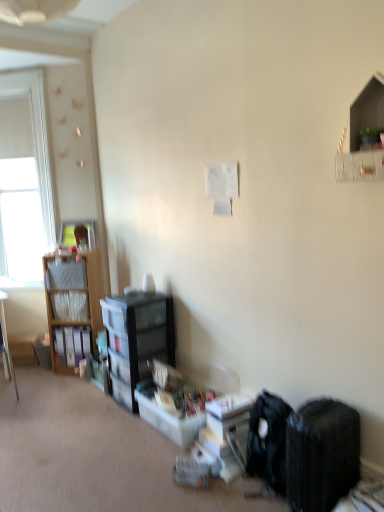
Question: Does black plastic bookcase at center-left have a larger size compared to white glossy shelf at upper right, placed as the first shelf when sorted from top to bottom?

Choices:
 (A) no
 (B) yes

Answer: (B)

Question: Can you confirm if black plastic bookcase at center-left is smaller than white glossy shelf at upper right, placed as the first shelf when sorted from top to bottom?

Choices:
 (A) yes
 (B) no

Answer: (B)

Question: From the image's perspective, is black plastic bookcase at center-left above white glossy shelf at upper right, placed as the first shelf when sorted from top to bottom?

Choices:
 (A) no
 (B) yes

Answer: (A)

Question: From the image's perspective, does black plastic bookcase at center-left appear lower than white glossy shelf at upper right, which ranks as the first shelf in front-to-back order?

Choices:
 (A) yes
 (B) no

Answer: (A)

Question: Does black plastic bookcase at center-left have a greater width compared to white glossy shelf at upper right, acting as the 3th shelf starting from the bottom?

Choices:
 (A) no
 (B) yes

Answer: (B)

Question: In the image, is black fabric backpack at lower right on the left side or the right side of matte plastic shelf at left, marked as the 3th shelf in a right-to-left arrangement?

Choices:
 (A) left
 (B) right

Answer: (B)

Question: In the image, is black fabric backpack at lower right positioned in front of or behind matte plastic shelf at left, which appears as the second shelf when ordered from the bottom?

Choices:
 (A) front
 (B) behind

Answer: (A)

Question: Considering the positions of point (332, 430) and point (72, 261), is point (332, 430) closer or farther from the camera than point (72, 261)?

Choices:
 (A) closer
 (B) farther

Answer: (A)

Question: From a real-world perspective, is black fabric backpack at lower right physically located above or below matte plastic shelf at left, which is counted as the first shelf, starting from the left?

Choices:
 (A) above
 (B) below

Answer: (B)

Question: Do you think white matte window screen at left is within matte wooden picture frame at upper left, or outside of it?

Choices:
 (A) outside
 (B) inside

Answer: (A)

Question: Considering their positions, is white matte window screen at left located in front of or behind matte wooden picture frame at upper left?

Choices:
 (A) front
 (B) behind

Answer: (A)

Question: Does point (31, 274) appear closer or farther from the camera than point (82, 223)?

Choices:
 (A) closer
 (B) farther

Answer: (B)

Question: Is white matte window screen at left bigger or smaller than matte wooden picture frame at upper left?

Choices:
 (A) big
 (B) small

Answer: (A)

Question: In terms of height, does white matte window screen at left look taller or shorter compared to black fabric backpack at lower right?

Choices:
 (A) tall
 (B) short

Answer: (A)

Question: Considering the relative positions of white matte window screen at left and black fabric backpack at lower right in the image provided, is white matte window screen at left to the left or to the right of black fabric backpack at lower right?

Choices:
 (A) right
 (B) left

Answer: (B)